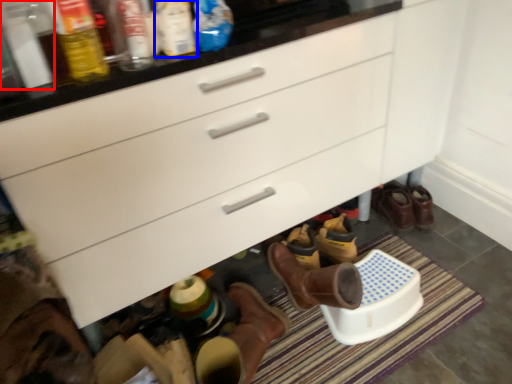
Question: Which point is closer to the camera, bottle (highlighted by a red box) or bottle (highlighted by a blue box)?

Choices:
 (A) bottle
 (B) bottle

Answer: (A)